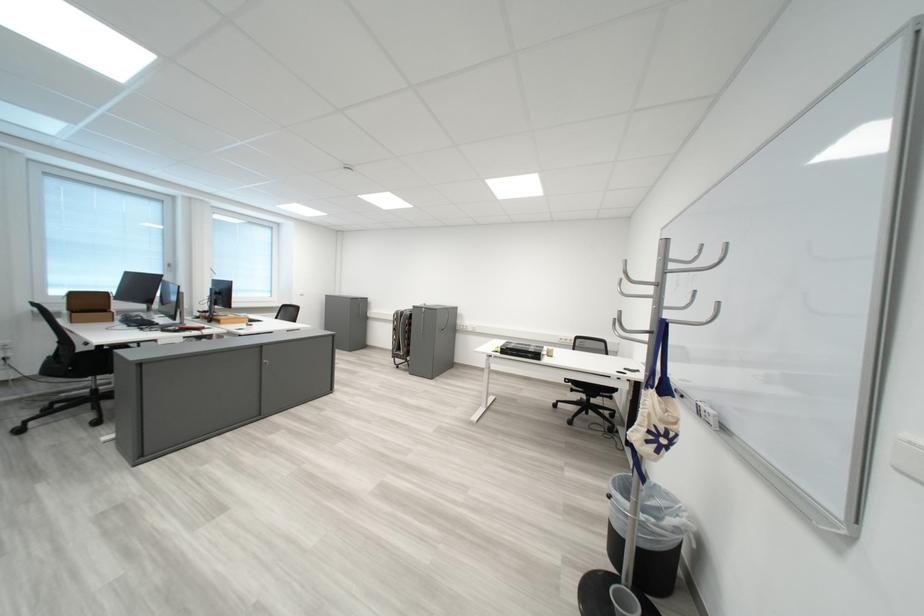
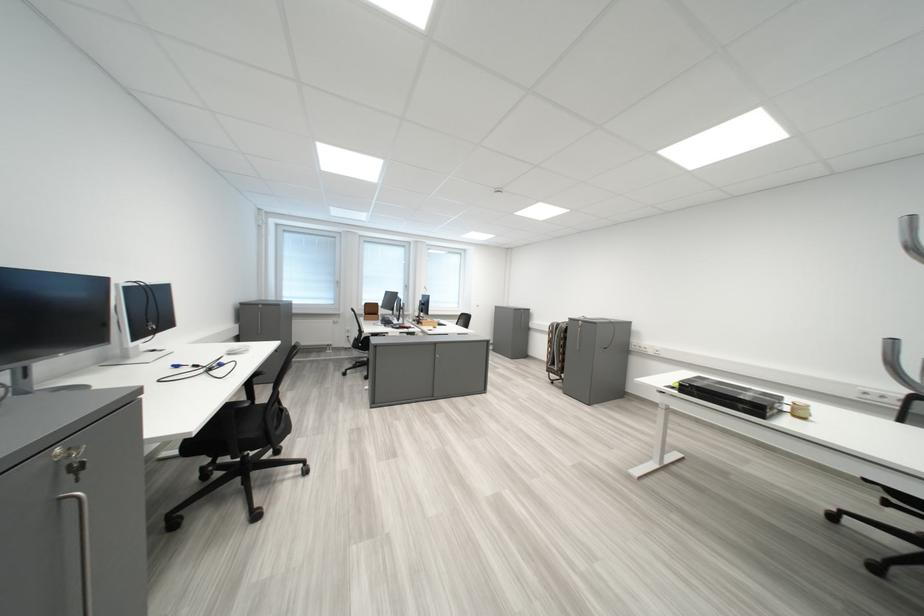
Question: The first image is from the beginning of the video and the second image is from the end. How did the camera likely rotate when shooting the video?

Choices:
 (A) Left
 (B) Right
 (C) Up
 (D) Down

Answer: (A)